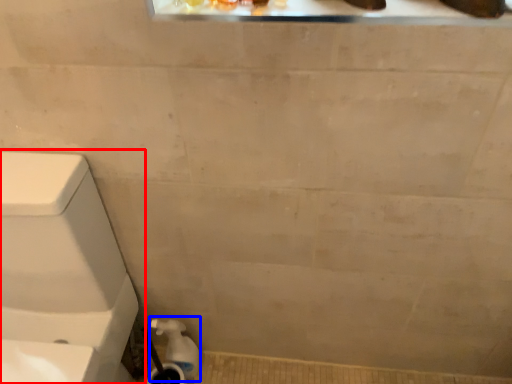
Question: Which of the following is the farthest to the observer, toilet (highlighted by a red box) or water pipe (highlighted by a blue box)?

Choices:
 (A) toilet
 (B) water pipe

Answer: (B)